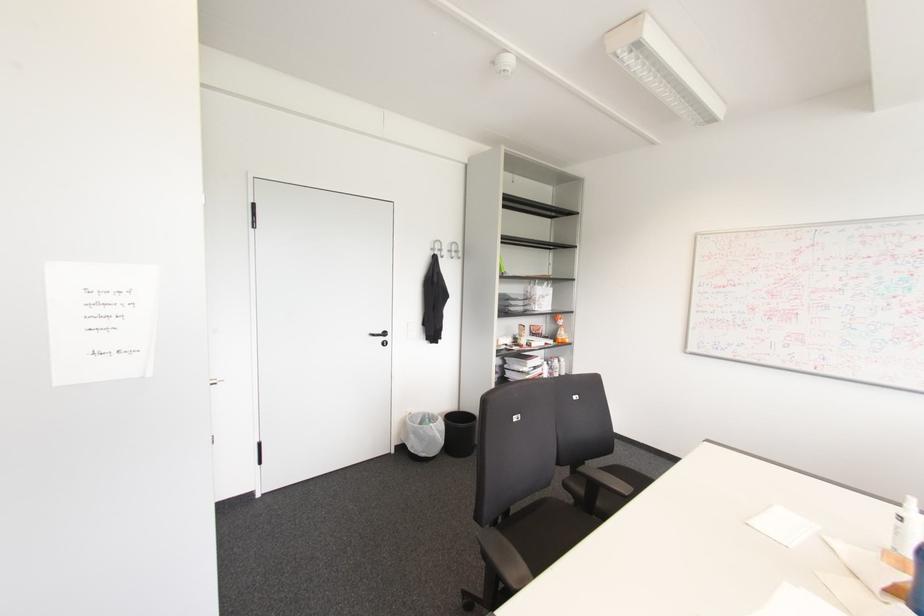
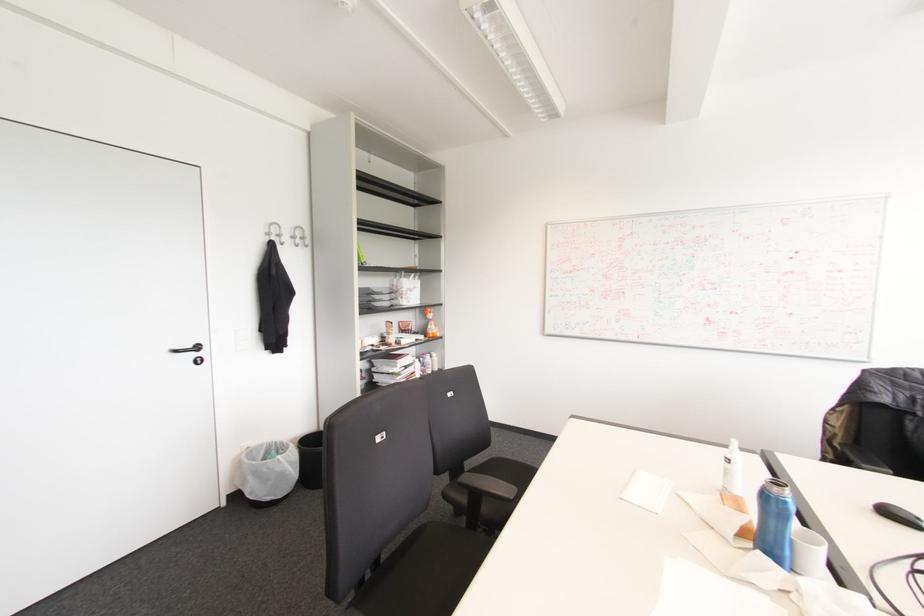
Question: The first image is from the beginning of the video and the second image is from the end. How did the camera likely rotate when shooting the video?

Choices:
 (A) Left
 (B) Right
 (C) Up
 (D) Down

Answer: (B)